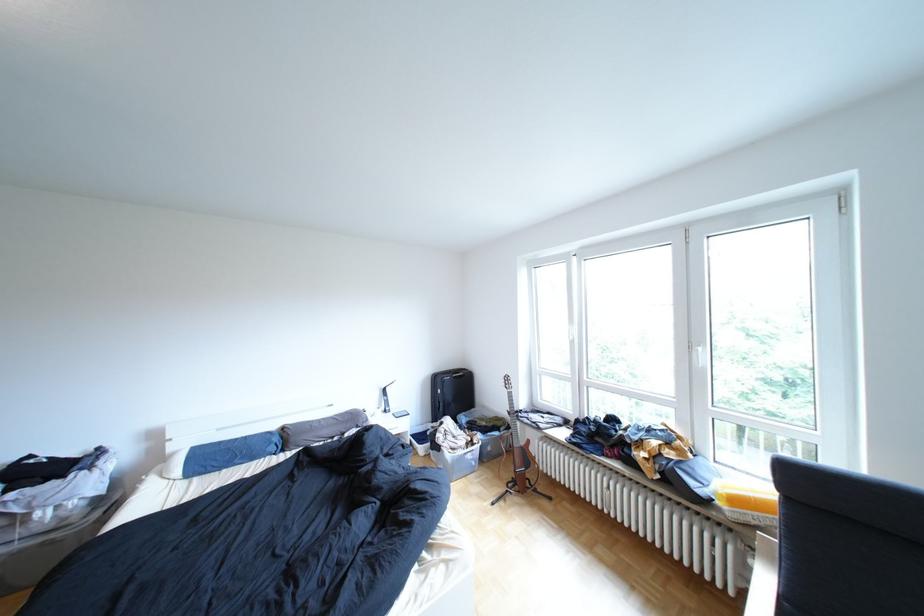
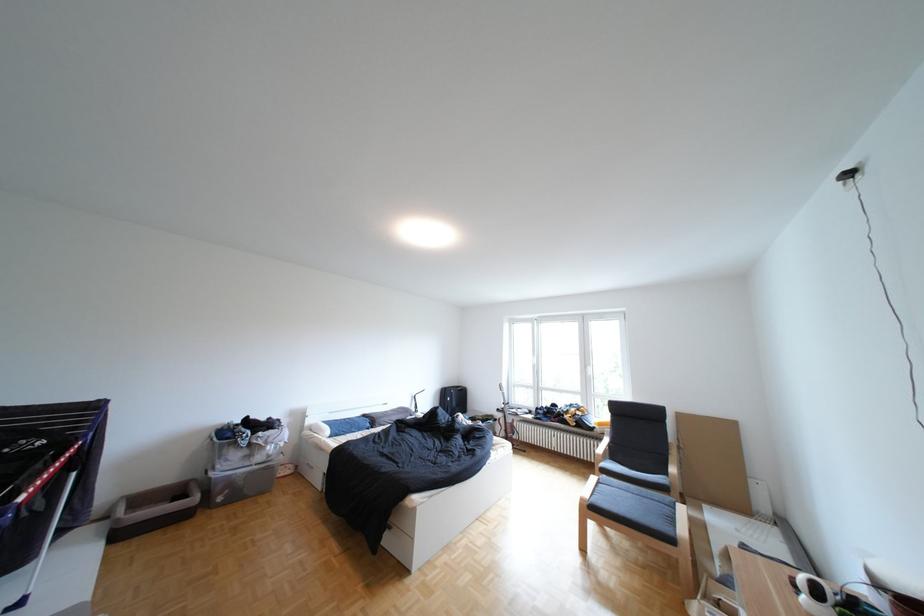
Which direction would the cameraman need to move to produce the second image?

The movement direction of the cameraman is left, backward.